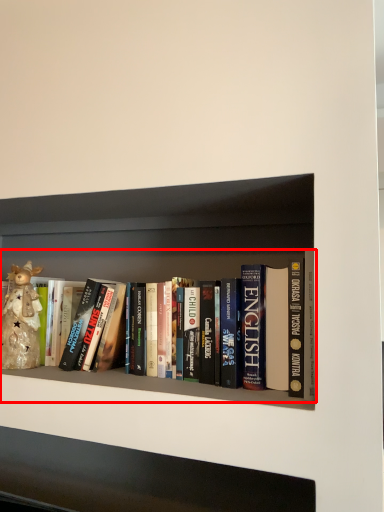
Question: In this image, where is book (annotated by the red box) located relative to toy?

Choices:
 (A) right
 (B) left

Answer: (A)